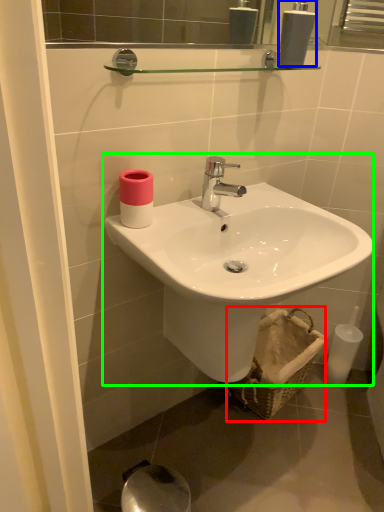
Question: Which object is positioned farthest from basket (highlighted by a red box)? Select from soap dispenser (highlighted by a blue box) and sink (highlighted by a green box).

Choices:
 (A) soap dispenser
 (B) sink

Answer: (A)